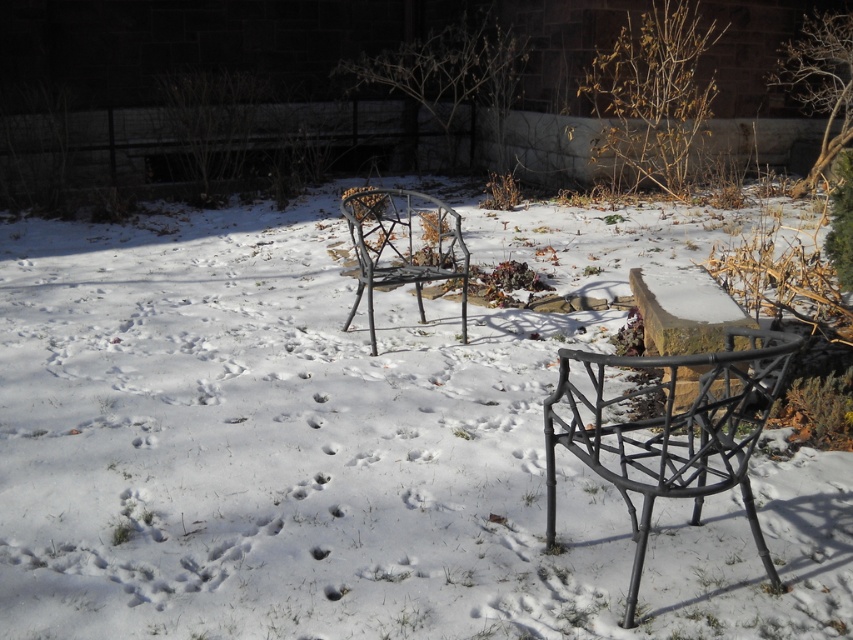
Question: Is white matte snow at center thinner than matte black chair at lower right?

Choices:
 (A) yes
 (B) no

Answer: (A)

Question: Which point appears closest to the camera in this image?

Choices:
 (A) (630, 488)
 (B) (416, 220)

Answer: (A)

Question: Can you confirm if white matte snow at center is positioned to the left of matte black chair at lower right?

Choices:
 (A) yes
 (B) no

Answer: (A)

Question: Where is white matte snow at center located in relation to metallic wire chair at center in the image?

Choices:
 (A) right
 (B) left

Answer: (B)

Question: Estimate the real-world distances between objects in this image. Which object is closer to the metallic wire chair at center?

Choices:
 (A) white matte snow at center
 (B) matte black chair at lower right

Answer: (B)

Question: Which object is the farthest from the metallic wire chair at center?

Choices:
 (A) matte black chair at lower right
 (B) white matte snow at center

Answer: (B)